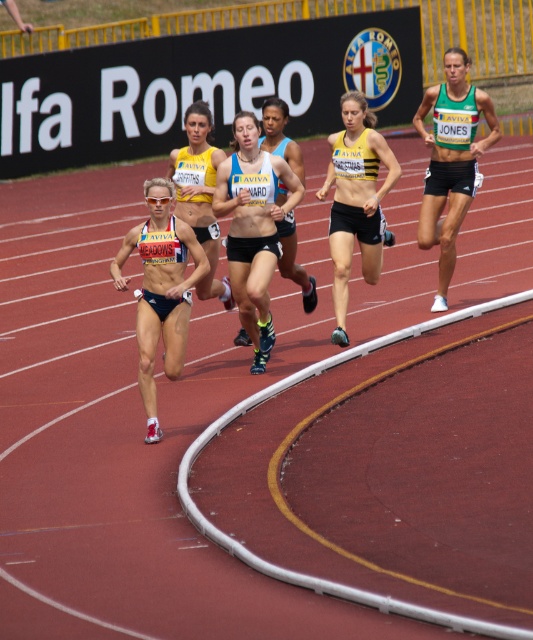
Question: Can you confirm if matte black shorts at center is positioned to the right of matte black running suit at center?

Choices:
 (A) no
 (B) yes

Answer: (A)

Question: Is green fabric tank top at right smaller than matte black running suit at center?

Choices:
 (A) yes
 (B) no

Answer: (B)

Question: Which of the following is the closest to the observer?

Choices:
 (A) matte black running suit at center
 (B) matte blue shorts at center

Answer: (B)

Question: Which of these objects is positioned farthest from the green fabric tank top at right?

Choices:
 (A) matte black running suit at center
 (B) matte black shorts at center
 (C) matte blue tank top at center

Answer: (B)

Question: Which object appears closest to the camera in this image?

Choices:
 (A) matte black shorts at center
 (B) yellow/black sports bra at center
 (C) matte blue tank top at center

Answer: (A)

Question: Does matte black shorts at center appear on the left side of matte blue tank top at center?

Choices:
 (A) yes
 (B) no

Answer: (A)